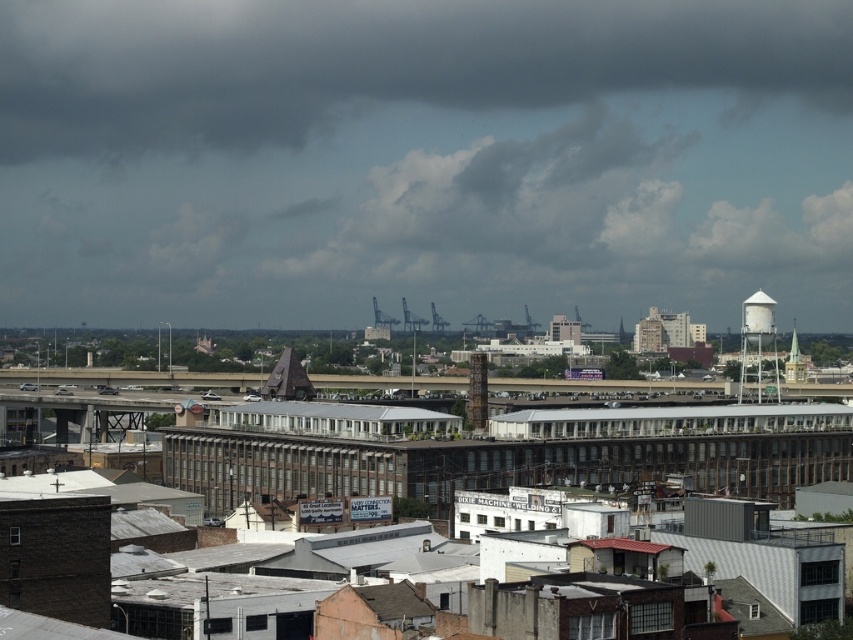
Which is above, dark gray cloud at upper center or white matte water tower at upper right?

dark gray cloud at upper center is higher up.

Does dark gray cloud at upper center have a lesser height compared to white matte water tower at upper right?

Incorrect, dark gray cloud at upper center's height does not fall short of white matte water tower at upper right's.

Find the location of a particular element. dark gray cloud at upper center is located at coordinates (376, 64).

I want to click on dark gray cloud at upper center, so click(376, 64).